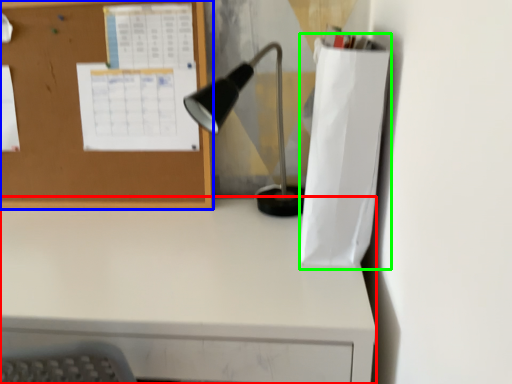
Question: Which object is the farthest from desk (highlighted by a red box)? Choose among these: bulletin board (highlighted by a blue box) or paper bag (highlighted by a green box).

Choices:
 (A) bulletin board
 (B) paper bag

Answer: (A)